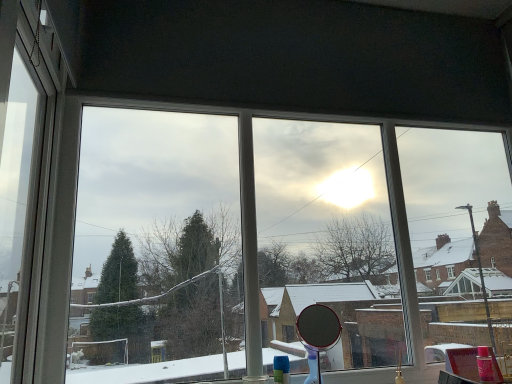
Question: From the image's perspective, relative to transparent glass mirror at center, is polished silver mirror at center above or below?

Choices:
 (A) below
 (B) above

Answer: (A)

Question: Considering their positions, is polished silver mirror at center located in front of or behind transparent glass mirror at center?

Choices:
 (A) front
 (B) behind

Answer: (A)

Question: Estimate the real-world distances between objects in this image. Which object is farther from the transparent glass mirror at center?

Choices:
 (A) polished silver mirror at center
 (B) white plastic window frame at left

Answer: (B)

Question: Which object is the farthest from the white plastic window frame at left?

Choices:
 (A) transparent glass mirror at center
 (B) polished silver mirror at center

Answer: (B)